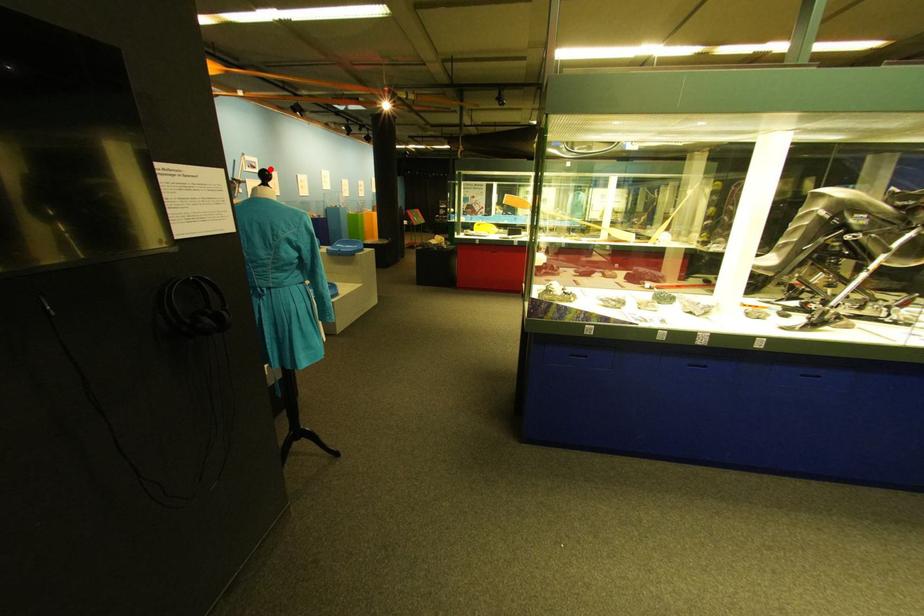
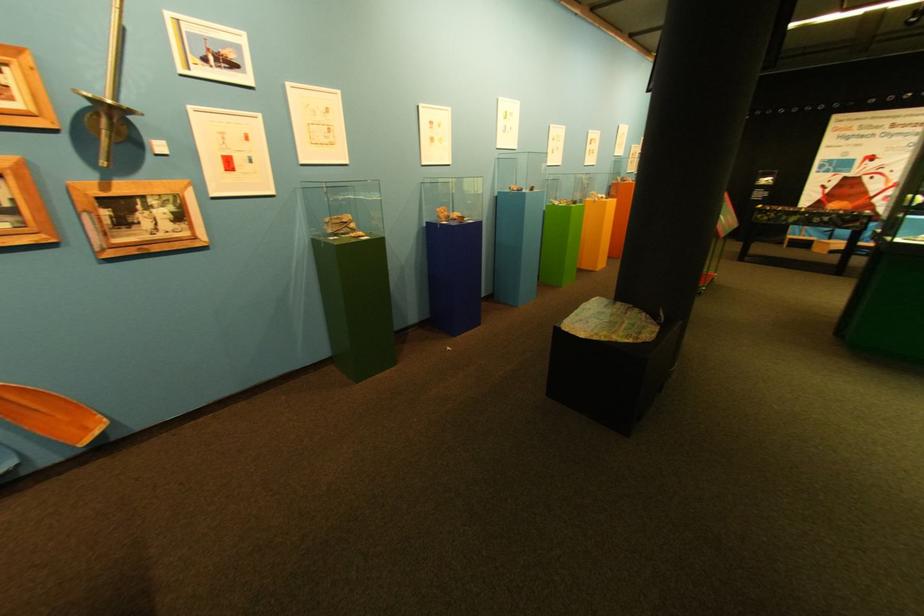
Question: I am providing you with two images of the same scene from different viewpoints. Given a red point in image1, look at the same physical point in image2. Is it:

Choices:
 (A) Closer to the viewpoint
 (B) Farther from the viewpoint

Answer: (B)